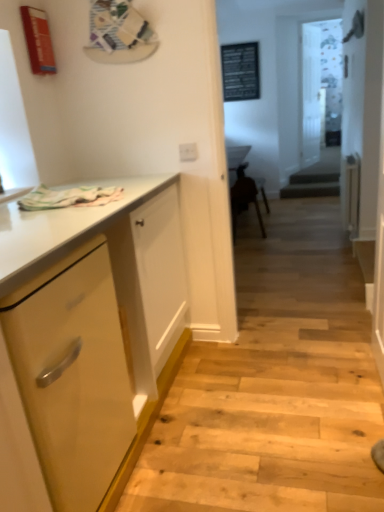
Question: Is point (34, 239) positioned closer to the camera than point (251, 180)?

Choices:
 (A) farther
 (B) closer

Answer: (B)

Question: Looking at their shapes, would you say matte yellow cabinet at left is wider or thinner than brown wooden chair at center?

Choices:
 (A) thin
 (B) wide

Answer: (B)

Question: Which of these objects is positioned closest to the brown wooden chair at center?

Choices:
 (A) white plastic electric outlet at upper center
 (B) transparent glass door at center, which is the first glass door in back-to-front order
 (C) matte yellow cabinet at left
 (D) transparent glass door at center, the 1th glass door in the front-to-back sequence
 (E) matte black bulletin board at upper center

Answer: (A)

Question: Which is nearer to the white plastic electric outlet at upper center?

Choices:
 (A) matte black bulletin board at upper center
 (B) transparent glass door at center, which is the first glass door in back-to-front order
 (C) transparent glass door at center, which appears as the 2th glass door when viewed from the back
 (D) brown wooden chair at center
 (E) matte yellow cabinet at left

Answer: (E)